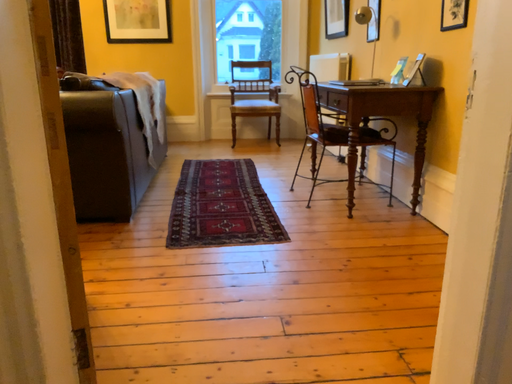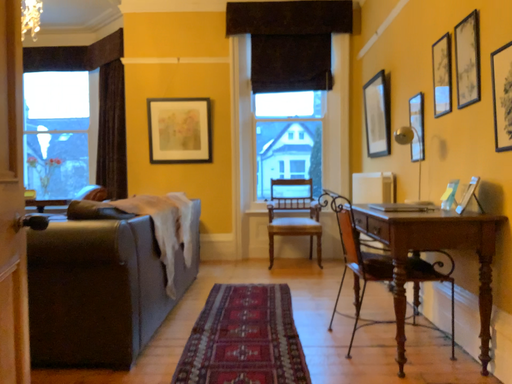
Question: How did the camera likely rotate when shooting the video?

Choices:
 (A) rotated left
 (B) rotated right

Answer: (A)